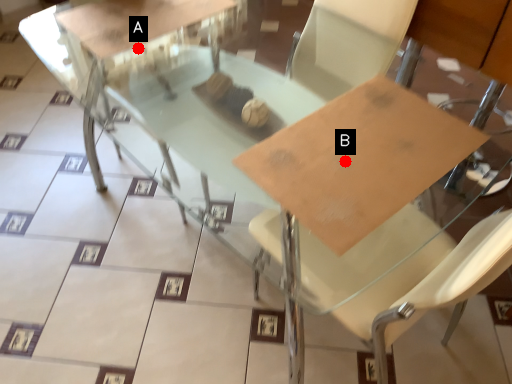
Question: Two points are circled on the image, labeled by A and B beside each circle. Which point is closer to the camera?

Choices:
 (A) A is closer
 (B) B is closer

Answer: (B)